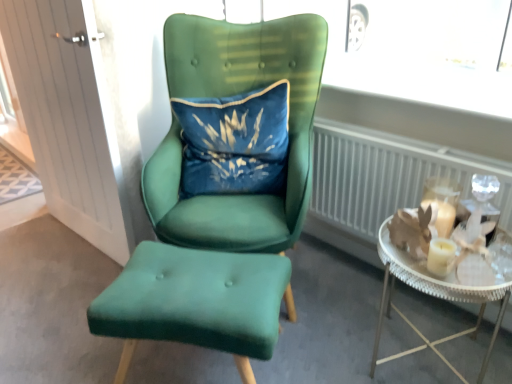
Where is `vacant space behind metallic silver tray at right`? The image size is (512, 384). vacant space behind metallic silver tray at right is located at coordinates (350, 288).